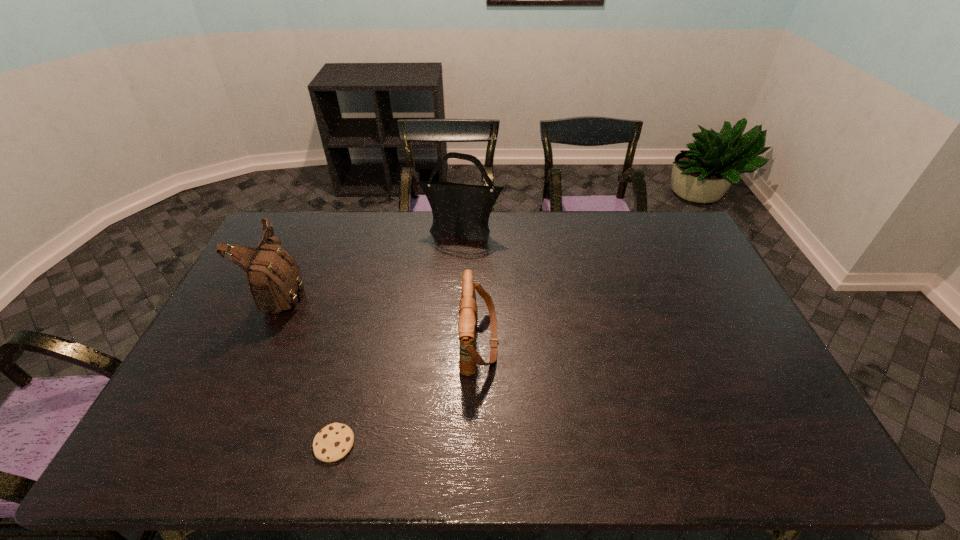
This screenshot has width=960, height=540. I want to click on the tallest object, so click(460, 209).

The height and width of the screenshot is (540, 960). Find the location of `the farthest shoulder bag`. the farthest shoulder bag is located at coordinates (460, 209).

Find the location of `the leftmost shoulder bag`. the leftmost shoulder bag is located at coordinates (274, 279).

The image size is (960, 540). Find the location of `the leftmost object`. the leftmost object is located at coordinates (274, 279).

What are the coordinates of `the shortest shoulder bag` in the screenshot? It's located at (468, 311).

Locate an element on the screen. The height and width of the screenshot is (540, 960). the shortest object is located at coordinates (332, 443).

Where is `cookie`? This screenshot has height=540, width=960. cookie is located at coordinates (332, 443).

The height and width of the screenshot is (540, 960). Find the location of `vacant space situated 0.080m on the right of the farthest shoulder bag`. vacant space situated 0.080m on the right of the farthest shoulder bag is located at coordinates (523, 232).

This screenshot has height=540, width=960. I want to click on free location located 0.130m on the front-facing side of the leftmost object, so click(347, 292).

Where is `free location located on the front-facing side of the second shortest object`? The height and width of the screenshot is (540, 960). free location located on the front-facing side of the second shortest object is located at coordinates (625, 341).